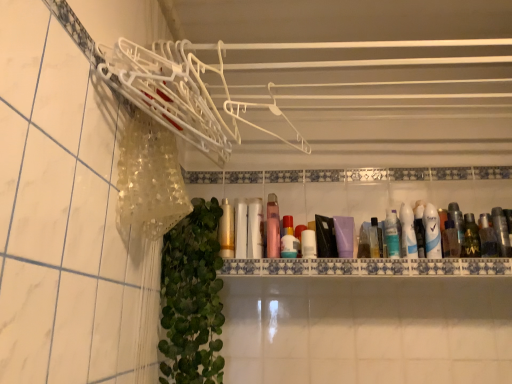
Question: Are white matte tube at center, which is the tenth mouthwash in right-to-left order, and white glossy tube at right, which is the 5th mouthwash in right-to-left order, far apart?

Choices:
 (A) yes
 (B) no

Answer: (B)

Question: From a real-world perspective, does white matte tube at center, which is the tenth mouthwash in right-to-left order, sit lower than white glossy tube at right, which is the 5th mouthwash in right-to-left order?

Choices:
 (A) no
 (B) yes

Answer: (B)

Question: Considering the relative sizes of white matte tube at center, which is the second mouthwash in left-to-right order, and white glossy tube at right, which is the 5th mouthwash in right-to-left order, in the image provided, is white matte tube at center, which is the second mouthwash in left-to-right order, taller than white glossy tube at right, which is the 5th mouthwash in right-to-left order,?

Choices:
 (A) no
 (B) yes

Answer: (B)

Question: Considering the relative sizes of white matte tube at center, which is the second mouthwash in left-to-right order, and white glossy tube at right, which is counted as the 7th mouthwash, starting from the left, in the image provided, is white matte tube at center, which is the second mouthwash in left-to-right order, wider than white glossy tube at right, which is counted as the 7th mouthwash, starting from the left,?

Choices:
 (A) yes
 (B) no

Answer: (A)

Question: Considering the relative sizes of white matte tube at center, which is the tenth mouthwash in right-to-left order, and white glossy tube at right, which is the 5th mouthwash in right-to-left order, in the image provided, is white matte tube at center, which is the tenth mouthwash in right-to-left order, bigger than white glossy tube at right, which is the 5th mouthwash in right-to-left order,?

Choices:
 (A) yes
 (B) no

Answer: (A)

Question: Is white matte tube at center, which is the tenth mouthwash in right-to-left order, at the right side of white glossy tube at right, which is counted as the 7th mouthwash, starting from the left?

Choices:
 (A) yes
 (B) no

Answer: (B)

Question: Is green matte bottle at right, which is the 9th mouthwash in left-to-right order, bigger than blue glossy mouthwash at right, placed as the sixth mouthwash when sorted from left to right?

Choices:
 (A) no
 (B) yes

Answer: (A)

Question: Is green matte bottle at right, which is the third mouthwash in right-to-left order, looking in the opposite direction of blue glossy mouthwash at right, placed as the sixth mouthwash when sorted from left to right?

Choices:
 (A) yes
 (B) no

Answer: (B)

Question: Is green matte bottle at right, which is the 9th mouthwash in left-to-right order, outside of blue glossy mouthwash at right, which ranks as the sixth mouthwash in right-to-left order?

Choices:
 (A) yes
 (B) no

Answer: (A)

Question: Could blue glossy mouthwash at right, which ranks as the sixth mouthwash in right-to-left order, be considered to be inside green matte bottle at right, which is the third mouthwash in right-to-left order?

Choices:
 (A) yes
 (B) no

Answer: (B)

Question: Are green matte bottle at right, which is the 9th mouthwash in left-to-right order, and blue glossy mouthwash at right, placed as the sixth mouthwash when sorted from left to right, far apart?

Choices:
 (A) no
 (B) yes

Answer: (A)

Question: Considering the relative sizes of green matte bottle at right, which is the third mouthwash in right-to-left order, and blue glossy mouthwash at right, placed as the sixth mouthwash when sorted from left to right, in the image provided, is green matte bottle at right, which is the third mouthwash in right-to-left order, smaller than blue glossy mouthwash at right, placed as the sixth mouthwash when sorted from left to right,?

Choices:
 (A) no
 (B) yes

Answer: (B)

Question: Does gold metallic mouthwash at center, the first mouthwash when ordered from left to right, lie in front of green matte bottle at right, which is the 9th mouthwash in left-to-right order?

Choices:
 (A) no
 (B) yes

Answer: (B)